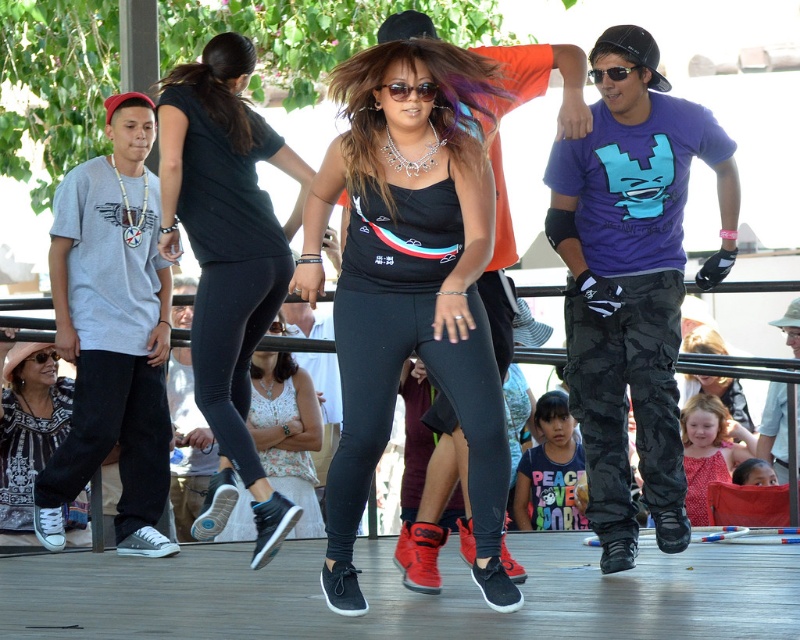
Between black matte tank top at center and black leggings at center, which one appears on the left side from the viewer's perspective?

From the viewer's perspective, black leggings at center appears more on the left side.

Does black matte tank top at center have a greater width compared to black leggings at center?

Indeed, black matte tank top at center has a greater width compared to black leggings at center.

Which is behind, point (418, 211) or point (244, 388)?

Positioned behind is point (244, 388).

Where is `black matte tank top at center`? black matte tank top at center is located at coordinates (409, 282).

Is point (612, 506) closer to camera compared to point (232, 364)?

Yes.

Is purple matte t-shirt at center to the right of black leggings at center from the viewer's perspective?

Yes, purple matte t-shirt at center is to the right of black leggings at center.

Who is more forward, (x=680, y=534) or (x=242, y=232)?

Answer: Positioned in front is point (x=680, y=534).

What are the coordinates of `purple matte t-shirt at center` in the screenshot? It's located at (632, 280).

Is point (558, 214) positioned behind point (352, 308)?

Yes, point (558, 214) is farther from viewer.

Which is more to the left, purple matte t-shirt at center or black matte leggings at center?

Positioned to the left is black matte leggings at center.

Is point (629, 291) farther from viewer compared to point (472, 397)?

Yes, point (629, 291) is farther from viewer.

At what (x,y) coordinates should I click in order to perform the action: click on purple matte t-shirt at center. Please return your answer as a coordinate pair (x, y). Looking at the image, I should click on (632, 280).